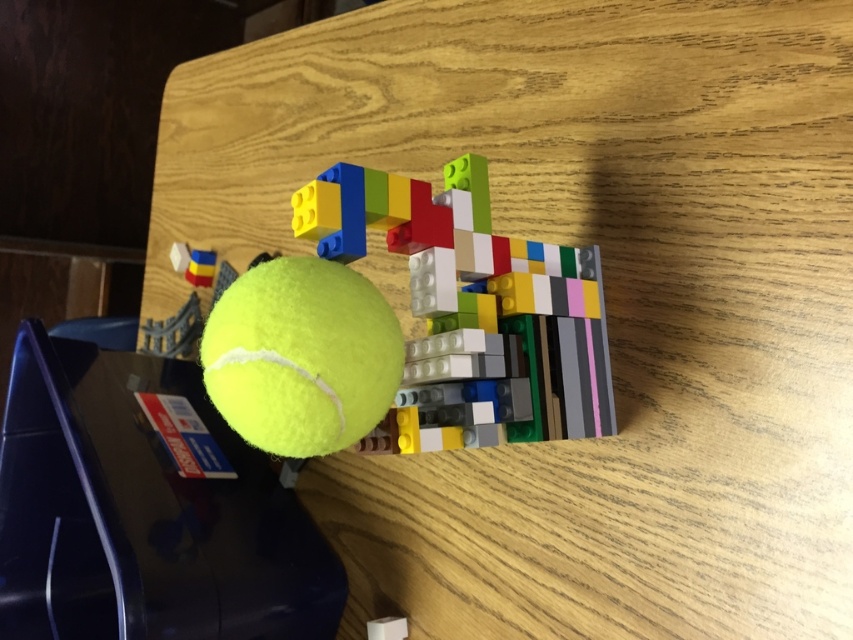
Who is positioned more to the left, multicolored plastic blocks at center or yellow matte tennis ball at center?

Positioned to the left is yellow matte tennis ball at center.

Image resolution: width=853 pixels, height=640 pixels. I want to click on multicolored plastic blocks at center, so click(x=474, y=296).

At what (x,y) coordinates should I click in order to perform the action: click on multicolored plastic blocks at center. Please return your answer as a coordinate pair (x, y). The image size is (853, 640). Looking at the image, I should click on [474, 296].